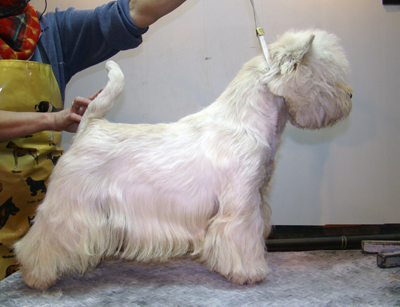
This screenshot has height=307, width=400. Identify the location of table. (325, 282).